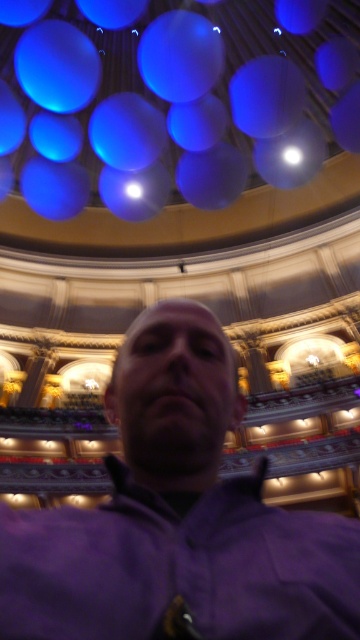
At what (x,y) coordinates should I click in order to perform the action: click on purple matte jacket at center. Please return your answer as a coordinate pair (x, y). This screenshot has width=360, height=640. Looking at the image, I should click on (177, 518).

Measure the distance between point (344, 564) and camera.

A distance of 24.93 meters exists between point (344, 564) and camera.

Is point (171, 476) closer to viewer compared to point (187, 72)?

Yes, it is in front of point (187, 72).

Identify the location of purple matte jacket at center. The height and width of the screenshot is (640, 360). (177, 518).